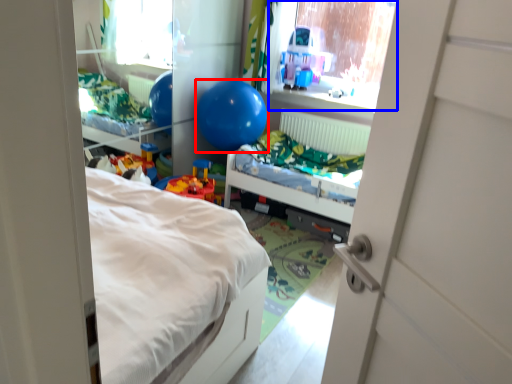
Question: Which object appears farthest to the camera in this image, balloon (highlighted by a red box) or window screen (highlighted by a blue box)?

Choices:
 (A) balloon
 (B) window screen

Answer: (B)